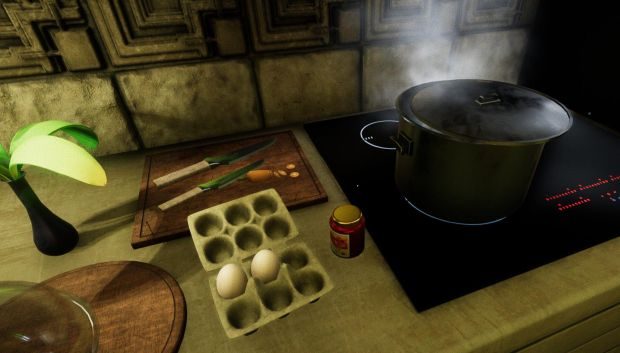
Find the location of a particular element. The width and height of the screenshot is (620, 353). kitchen photo of stove and counter is located at coordinates (449, 44).